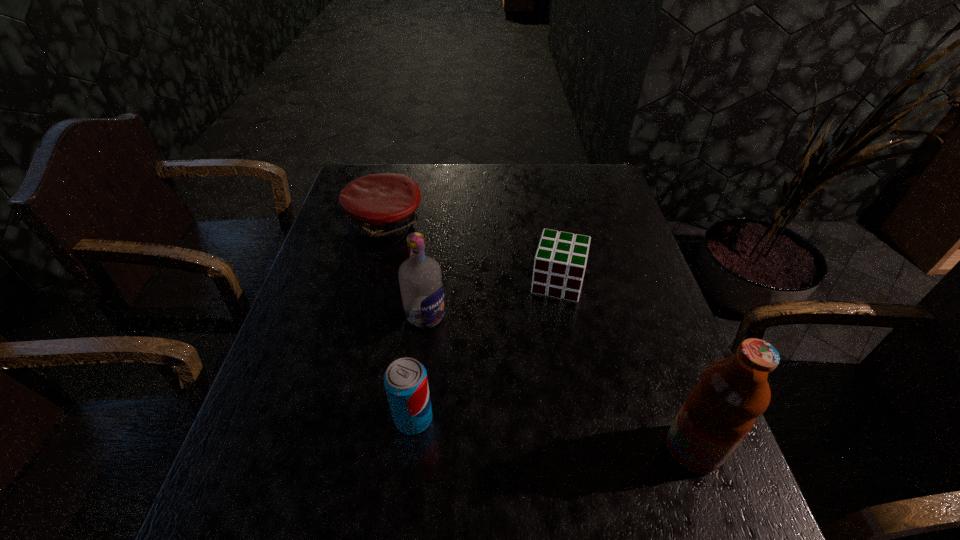
Identify the location of soda can positioned at the near edge. (405, 380).

Locate an element on the screen. The image size is (960, 540). fruit juice present at the near edge is located at coordinates (721, 409).

Find the location of a particular element. The image size is (960, 540). object that is at the left edge is located at coordinates pos(380,207).

You are a GUI agent. You are given a task and a screenshot of the screen. Output one action in this format:
    pyautogui.click(x=<x>, y=<y>)
    Task: Click on the object that is at the right edge
    
    Given the screenshot: What is the action you would take?
    pyautogui.click(x=721, y=409)

Locate an element on the screen. The image size is (960, 540). object situated at the far left corner is located at coordinates (380, 207).

Locate an element on the screen. The height and width of the screenshot is (540, 960). object positioned at the near right corner is located at coordinates (721, 409).

Image resolution: width=960 pixels, height=540 pixels. In order to click on free space at the far edge of the desktop in this screenshot , I will do coord(466,168).

Locate an element on the screen. vacant region at the left edge of the desktop is located at coordinates (325, 345).

Find the location of a particular element. vacant space at the right edge is located at coordinates (638, 324).

In the image, there is a desktop. At what (x,y) coordinates should I click in order to perform the action: click on vacant space at the far right corner. Please return your answer as a coordinate pair (x, y). Looking at the image, I should click on pos(614,191).